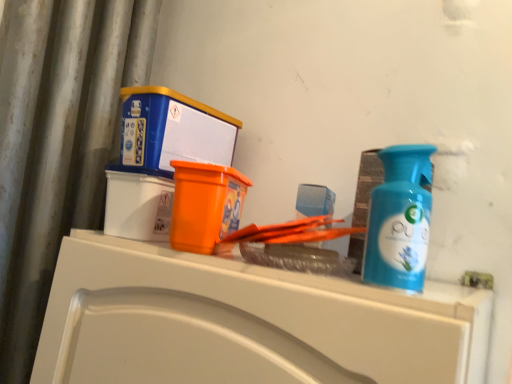
Question: Is blue plastic bottle at right bigger than blue plastic box at upper left?

Choices:
 (A) no
 (B) yes

Answer: (A)

Question: Considering the relative sizes of blue plastic bottle at right and blue plastic box at upper left in the image provided, is blue plastic bottle at right taller than blue plastic box at upper left?

Choices:
 (A) yes
 (B) no

Answer: (A)

Question: Is the position of blue plastic bottle at right less distant than that of blue plastic box at upper left?

Choices:
 (A) no
 (B) yes

Answer: (B)

Question: Is there a large distance between blue plastic bottle at right and blue plastic box at upper left?

Choices:
 (A) no
 (B) yes

Answer: (A)

Question: Is blue plastic bottle at right wider than blue plastic box at upper left?

Choices:
 (A) no
 (B) yes

Answer: (A)

Question: Is point (151, 114) positioned closer to the camera than point (140, 281)?

Choices:
 (A) closer
 (B) farther

Answer: (B)

Question: In terms of height, does blue plastic box at upper left look taller or shorter compared to white glossy counter at upper center?

Choices:
 (A) tall
 (B) short

Answer: (B)

Question: Is blue plastic box at upper left situated inside white glossy counter at upper center or outside?

Choices:
 (A) inside
 (B) outside

Answer: (B)

Question: Considering the relative positions of blue plastic box at upper left and white glossy counter at upper center in the image provided, is blue plastic box at upper left to the left or to the right of white glossy counter at upper center?

Choices:
 (A) left
 (B) right

Answer: (A)

Question: In terms of width, does white glossy counter at upper center look wider or thinner when compared to blue plastic bottle at right?

Choices:
 (A) thin
 (B) wide

Answer: (B)

Question: From a real-world perspective, relative to blue plastic bottle at right, is white glossy counter at upper center vertically above or below?

Choices:
 (A) below
 (B) above

Answer: (A)

Question: From the image's perspective, relative to blue plastic bottle at right, is white glossy counter at upper center above or below?

Choices:
 (A) below
 (B) above

Answer: (A)

Question: In the image, is white glossy counter at upper center on the left side or the right side of blue plastic bottle at right?

Choices:
 (A) right
 (B) left

Answer: (B)

Question: Is blue plastic bottle at right inside or outside of white glossy counter at upper center?

Choices:
 (A) inside
 (B) outside

Answer: (B)

Question: Is point (421, 157) closer or farther from the camera than point (342, 372)?

Choices:
 (A) farther
 (B) closer

Answer: (A)